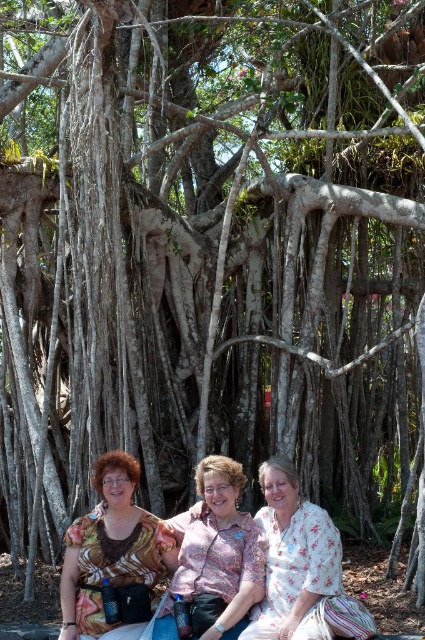
Question: Which point appears closest to the camera in this image?

Choices:
 (A) (260, 538)
 (B) (289, 547)
 (C) (127, 577)

Answer: (B)

Question: Which is nearer to the printed fabric blouse at lower left?

Choices:
 (A) floral fabric blouse at center
 (B) pink floral blouse at center

Answer: (B)

Question: Is printed fabric blouse at lower left in front of floral fabric blouse at center?

Choices:
 (A) no
 (B) yes

Answer: (A)

Question: Can you confirm if printed fabric blouse at lower left is wider than pink floral blouse at center?

Choices:
 (A) yes
 (B) no

Answer: (A)

Question: Which object is the farthest from the printed fabric blouse at lower left?

Choices:
 (A) floral fabric blouse at center
 (B) pink floral blouse at center

Answer: (A)

Question: Is pink floral blouse at center positioned before floral fabric blouse at center?

Choices:
 (A) yes
 (B) no

Answer: (B)